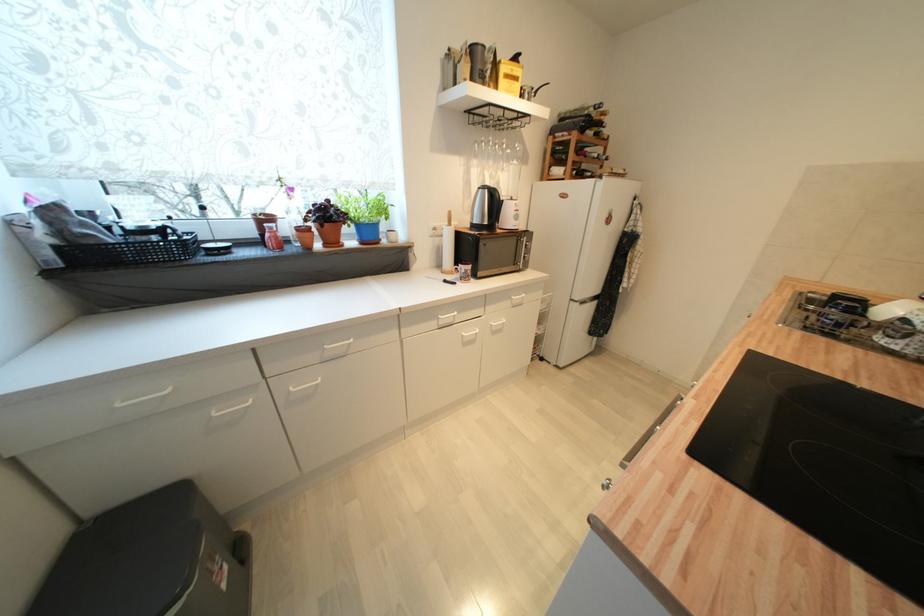
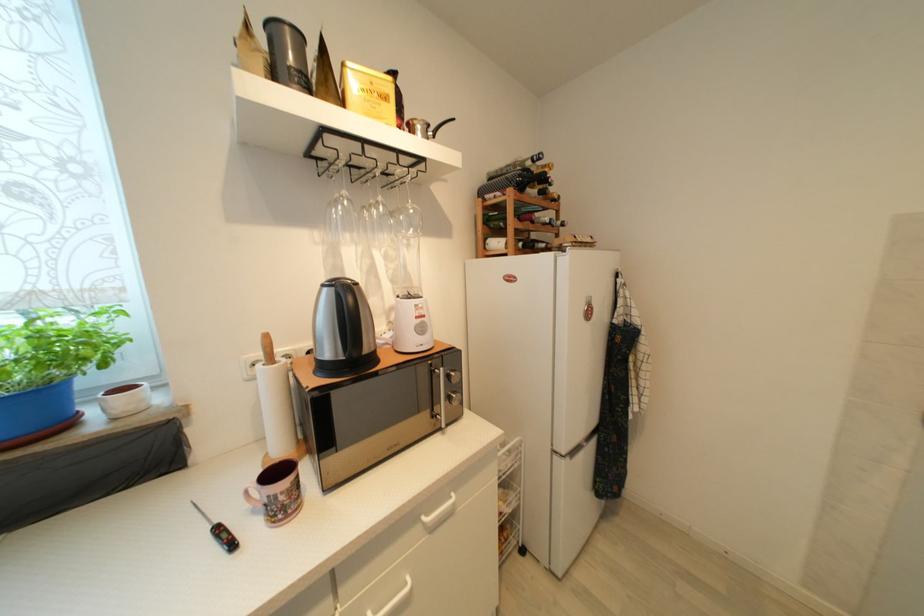
Where in the second image is the point corresponding to pixel 505 175 from the first image?

(409, 253)